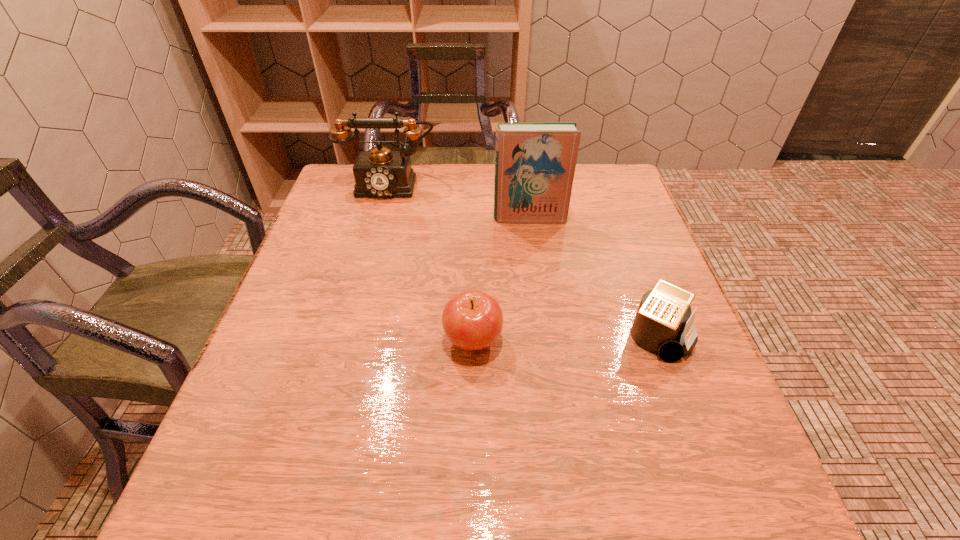
Find the location of a particular element. free space located on the front of the calculator is located at coordinates (701, 456).

This screenshot has width=960, height=540. Find the location of `object situated at the far edge`. object situated at the far edge is located at coordinates (379, 173).

The height and width of the screenshot is (540, 960). What are the coordinates of `object that is at the left edge` in the screenshot? It's located at (379, 173).

You are a GUI agent. You are given a task and a screenshot of the screen. Output one action in this format:
    pyautogui.click(x=<x>, y=<y>)
    Task: Click on the object that is at the right edge
    
    Given the screenshot: What is the action you would take?
    pyautogui.click(x=663, y=324)

I want to click on object at the far left corner, so click(379, 173).

In order to click on free spot at the far edge of the desktop in this screenshot , I will do `click(452, 190)`.

At what (x,y) coordinates should I click in order to perform the action: click on free region at the left edge of the desktop. Please return your answer as a coordinate pair (x, y). The image size is (960, 540). Looking at the image, I should click on (356, 237).

At what (x,y) coordinates should I click in order to perform the action: click on vacant space at the right edge of the desktop. Please return your answer as a coordinate pair (x, y). This screenshot has width=960, height=540. Looking at the image, I should click on (629, 239).

The height and width of the screenshot is (540, 960). I want to click on blank space at the far right corner, so click(x=603, y=166).

Locate an element on the screen. vacant space that's between the calculator and the apple is located at coordinates (564, 339).